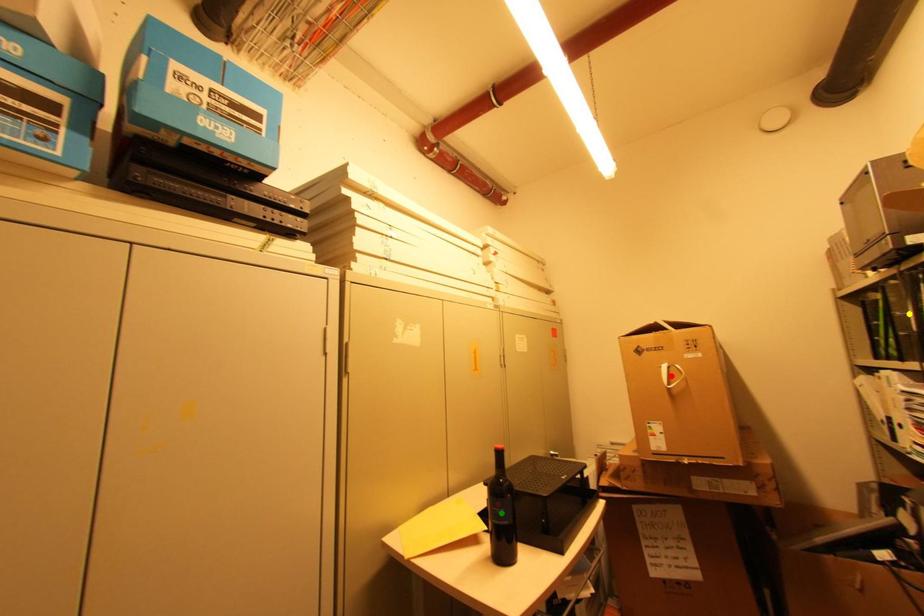
Order these from nearest to farthest:
green point, red point, yellow point

red point
green point
yellow point